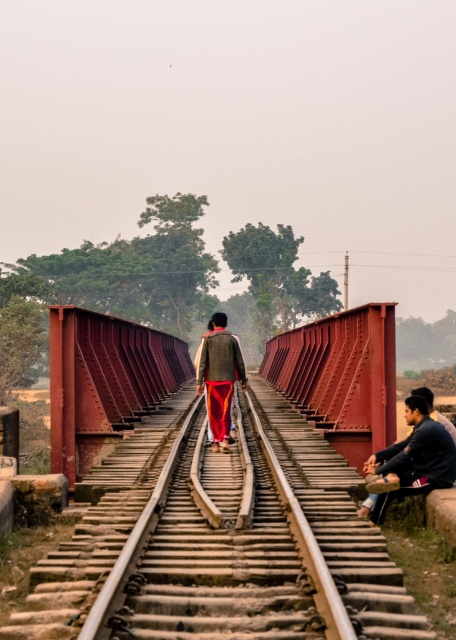
You are standing on the railway bridge and see two points marked on the tracks. Which point is closer to you, point [146,547] or point [218,349]?

Point [146,547] is closer to the viewer than point [218,349].

Consider the image. You are standing on the railway bridge and want to walk to the center of the tracks. Is the point at coordinates (219, 552) the location of the rusty metal train track at center?

Yes, the point at coordinates (219, 552) corresponds to the rusty metal train track at center, so walking towards that point will lead you to the center of the tracks.

You are standing on the railway bridge and see the rusty metal train track at center and the textured woolen sweater at center. Which object is closer to the left side of the bridge?

The rusty metal train track at center is to the left of the textured woolen sweater at center, so it is closer to the left side of the bridge.